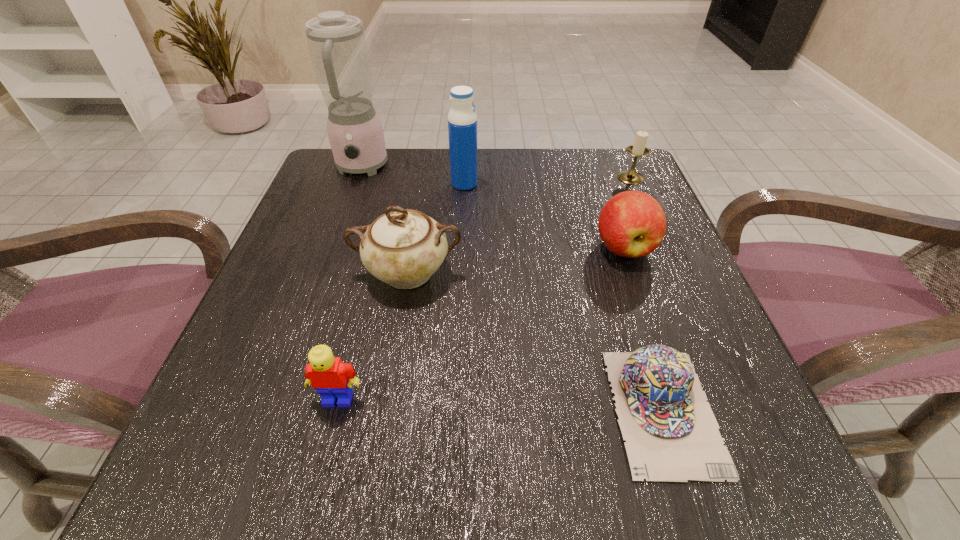
Locate an element on the screen. candle holder located in the right edge section of the desktop is located at coordinates (638, 149).

What are the coordinates of `apple that is at the right edge` in the screenshot? It's located at (632, 224).

This screenshot has width=960, height=540. Identify the location of cap that is at the right edge. (671, 433).

Identify the location of object present at the far left corner. (337, 45).

Where is `object at the far right corner`? This screenshot has width=960, height=540. object at the far right corner is located at coordinates (638, 149).

Locate an element on the screen. This screenshot has height=540, width=960. object located in the near right corner section of the desktop is located at coordinates (671, 433).

Identify the location of vacant space at the far edge of the desktop. The height and width of the screenshot is (540, 960). (431, 185).

In the image, there is a desktop. Identify the location of blank space at the left edge. This screenshot has width=960, height=540. pyautogui.click(x=340, y=221).

This screenshot has height=540, width=960. What are the coordinates of `vacant area at the far left corner` in the screenshot? It's located at (377, 185).

I want to click on blank area at the near left corner, so click(x=227, y=455).